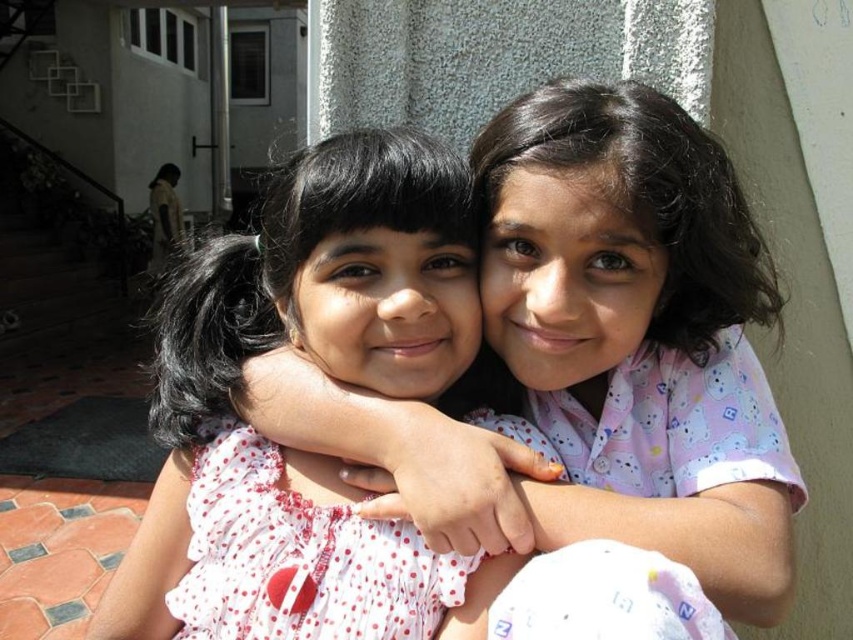
You are a photographer trying to capture a candid shot of two girls hugging. You notice the white dotted dress at center and the white polka dot fabric dress at center. Which dress should you focus on to ensure the subject is taller in the frame?

The white dotted dress at center is taller than the white polka dot fabric dress at center, so focusing on the white dotted dress at center will ensure the subject appears taller in the frame.

You are a photographer trying to capture a closeup shot of the girls. You have two points marked in the image for focus. Point A is at coordinates point (180,566) and Point B is at point (451,580). Which point should you focus on to ensure the foreground girl is in focus?

Point A at point (180,566) should be focused on because it is closer to the viewer than point B, ensuring the foreground girl is in focus.

You are a photographer trying to capture the two girls in the scene. You want to ensure that the white dotted dress at center and the white polka dot fabric dress at center are both visible in the frame. Which dress should you adjust your camera to focus on first to ensure both are in the shot?

The white dotted dress at center is positioned on the left side of the white polka dot fabric dress at center, so you should focus on the white polka dot fabric dress at center first to ensure both are in the frame.